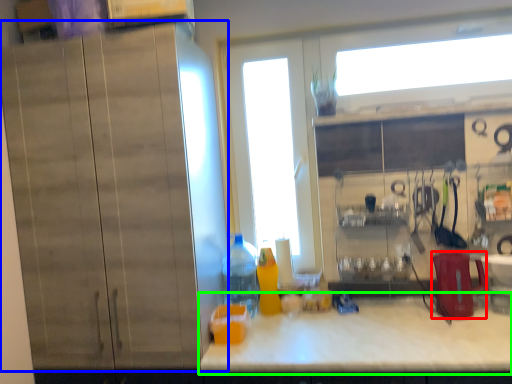
Question: Considering the real-world distances, which object is farthest from appliance (highlighted by a red box)? cabinetry (highlighted by a blue box) or countertop (highlighted by a green box)?

Choices:
 (A) cabinetry
 (B) countertop

Answer: (A)